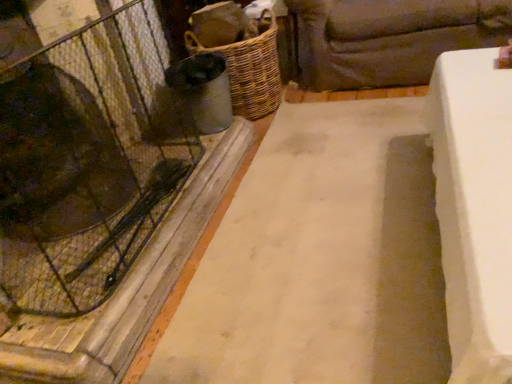
Question: In terms of width, does white concrete slab at center look wider or thinner when compared to woven brown basket at center-left?

Choices:
 (A) thin
 (B) wide

Answer: (B)

Question: Is white concrete slab at center situated inside woven brown basket at center-left or outside?

Choices:
 (A) outside
 (B) inside

Answer: (A)

Question: Which is farther from the woven brown basket at center-left?

Choices:
 (A) white concrete slab at center
 (B) dark brown fabric couch at upper right
 (C) transparent glass door at left

Answer: (A)

Question: Based on their relative distances, which object is nearer to the transparent glass door at left?

Choices:
 (A) dark brown fabric couch at upper right
 (B) white concrete slab at center
 (C) woven brown basket at center-left

Answer: (B)